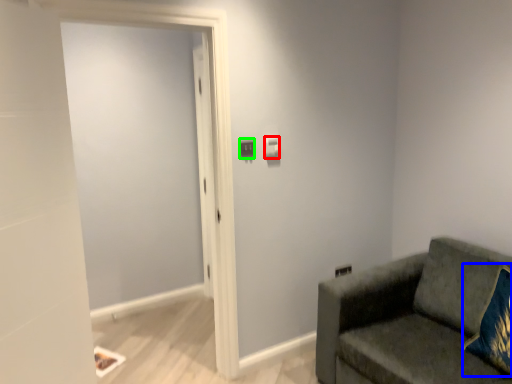
Question: Which is nearer to the light switch (highlighted by a red box)? throw pillow (highlighted by a blue box) or light switch (highlighted by a green box).

Choices:
 (A) throw pillow
 (B) light switch

Answer: (B)